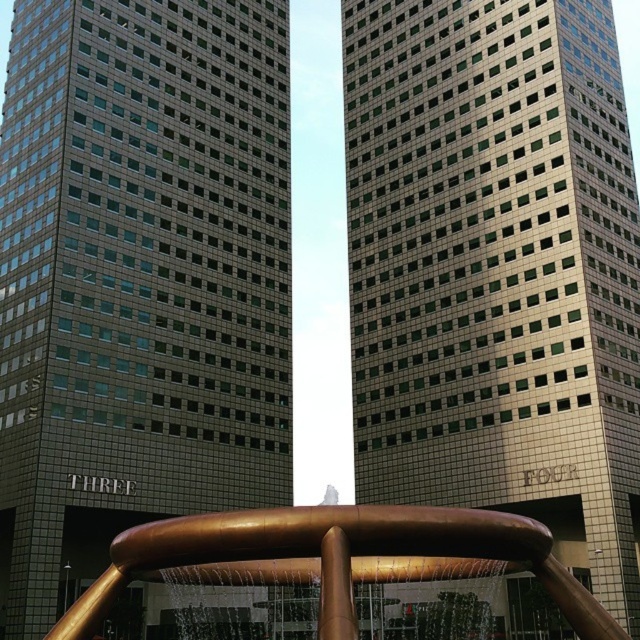
How distant is satin gold glass tower at center from gold polished water at center?

144.30 feet

Does satin gold glass tower at center have a lesser height compared to gold polished water at center?

Incorrect, satin gold glass tower at center's height does not fall short of gold polished water at center's.

Does point (556, 83) lie behind point (266, 561)?

Yes, point (556, 83) is behind point (266, 561).

Identify the location of satin gold glass tower at center. The width and height of the screenshot is (640, 640). 497,269.

Which is in front, point (209, 282) or point (193, 531)?

Point (193, 531) is in front.

Between point (77, 35) and point (288, 518), which one is positioned in front?

Positioned in front is point (288, 518).

Find the location of `matte gray building at center`. matte gray building at center is located at coordinates (138, 280).

Consider the image. Can you confirm if matte gray building at center is thinner than satin gold glass tower at center?

Incorrect, matte gray building at center's width is not less than satin gold glass tower at center's.

Between matte gray building at center and satin gold glass tower at center, which one has less height?

matte gray building at center is shorter.

The height and width of the screenshot is (640, 640). Identify the location of matte gray building at center. (138, 280).